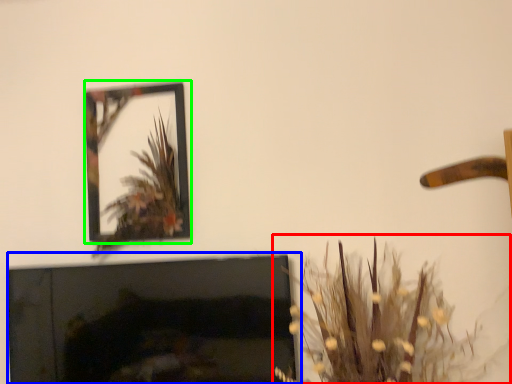
Question: Which is nearer to the houseplant (highlighted by a red box)? fireplace (highlighted by a blue box) or picture frame (highlighted by a green box).

Choices:
 (A) fireplace
 (B) picture frame

Answer: (A)